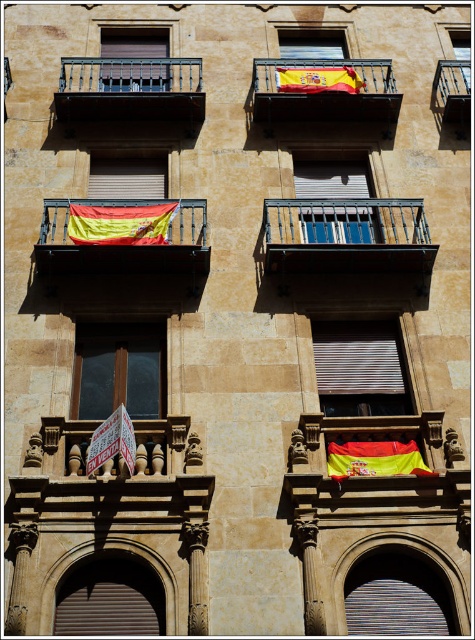
You are a window cleaner standing on the ground looking up at the building. You need to clean the metallic railing at upper right and the matte glass window at upper right. Which one should you clean first if you want to start with the one closer to you?

You should clean the metallic railing at upper right first because it is closer to you than the matte glass window at upper right.

You are standing in front of the building and notice two points marked on the facade. The first point is at coordinates point (93, 426) and the second is at point (93, 168). Which point is closer to you?

Point (93, 426) is closer to the camera than point (93, 168).

You are a window installer standing on the balcony and need to replace the metallic railing at upper right and the matte glass window at upper right. Which object should you adjust first if you want to start with the one closer to the left side?

The metallic railing at upper right is positioned on the left side of matte glass window at upper right, so you should adjust the metallic railing at upper right first since it is closer to the left side.